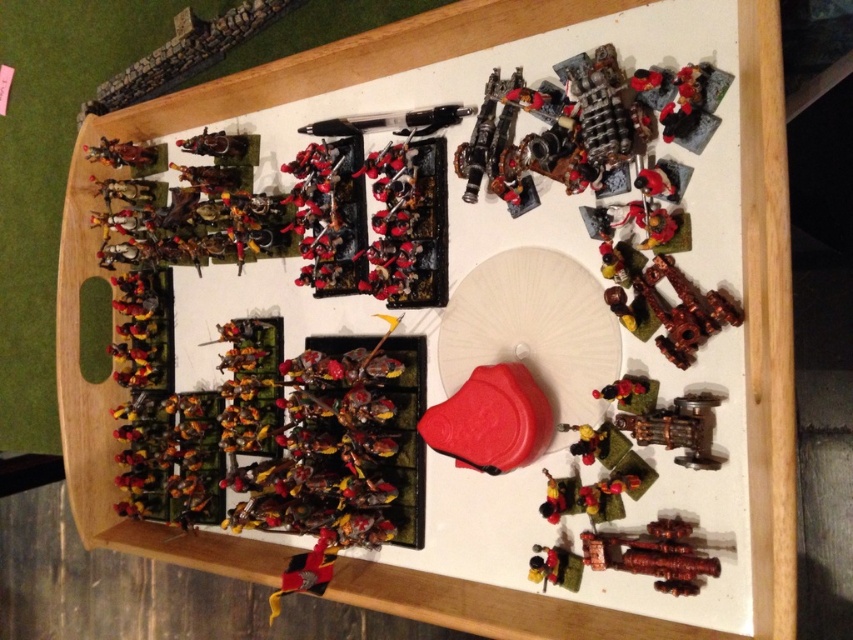
You are a player in a tabletop game and need to place a new figurine on the white paper plate at center. Your figurine is 1.20 meters tall. Will it fit on the plate without exceeding the height limit?

The white paper plate at center is only 1.30 meters away from the camera, so the height limit is not specified. Therefore, the figurine might fit, but it depends on the plate size and height restrictions not mentioned here.

You are a game master setting up a tabletop game. You have a white paper plate at center and a shiny gold armor at upper left. Which object is positioned to the right of the other?

The white paper plate at center is to the right of the shiny gold armor at upper left.